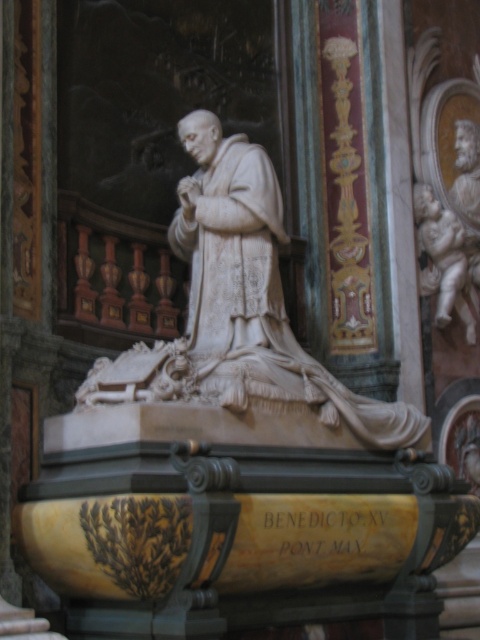
In the scene shown: You are an art conservator examining the white marble statue at center. Based on its position in the image, can you determine if it is centered both horizontally and vertically?

The white marble statue at center is located at the coordinates point (238,307), which is very close to the center point of the image, so it can be considered centered both horizontally and vertically.

You are an art conservator assessing the placement of the white marble statue at center and the white marble cherub at upper right. Based on their positions, which object is closer to the viewer?

The white marble statue at center is closer to the viewer because it is positioned over the white marble cherub at upper right, indicating it is in front of it.